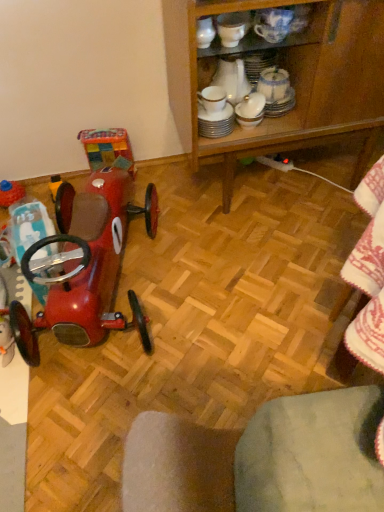
Question: Should I look upward or downward to see wooden cabinet at center?

Choices:
 (A) down
 (B) up

Answer: (B)

Question: Does shiny red car at left, which is counted as the 1th toy, starting from the back, contain shiny red car at left, which is the 1th toy in right-to-left order?

Choices:
 (A) yes
 (B) no

Answer: (B)

Question: Is shiny red car at left, the second toy viewed from the front, positioned before shiny red car at left, acting as the second toy starting from the left?

Choices:
 (A) yes
 (B) no

Answer: (B)

Question: From a real-world perspective, is shiny red car at left, which ranks as the second toy in right-to-left order, located beneath shiny red car at left, arranged as the 2th toy when viewed from the back?

Choices:
 (A) no
 (B) yes

Answer: (B)

Question: Could you tell me if shiny red car at left, the 1th toy from the left, is facing shiny red car at left, which is the first toy from front to back?

Choices:
 (A) no
 (B) yes

Answer: (A)

Question: From the image's perspective, would you say shiny red car at left, the second toy viewed from the front, is shown under shiny red car at left, arranged as the 2th toy when viewed from the back?

Choices:
 (A) yes
 (B) no

Answer: (B)

Question: Is shiny red car at left, the second toy viewed from the front, further to the viewer compared to shiny red car at left, acting as the second toy starting from the left?

Choices:
 (A) no
 (B) yes

Answer: (B)

Question: Is wooden cabinet at center at the right side of shiny red car at left, acting as the second toy starting from the left?

Choices:
 (A) yes
 (B) no

Answer: (A)

Question: Is wooden cabinet at center smaller than shiny red car at left, which is the 1th toy in right-to-left order?

Choices:
 (A) no
 (B) yes

Answer: (A)

Question: Does wooden cabinet at center have a greater height compared to shiny red car at left, acting as the second toy starting from the left?

Choices:
 (A) no
 (B) yes

Answer: (B)

Question: Does wooden cabinet at center have a greater width compared to shiny red car at left, arranged as the 2th toy when viewed from the back?

Choices:
 (A) no
 (B) yes

Answer: (A)

Question: From a real-world perspective, is wooden cabinet at center located higher than shiny red car at left, which is the 1th toy in right-to-left order?

Choices:
 (A) no
 (B) yes

Answer: (B)

Question: From the image's perspective, is wooden cabinet at center above shiny red car at left, which is the first toy from front to back?

Choices:
 (A) no
 (B) yes

Answer: (B)

Question: From a real-world perspective, is shiny red car at left, which is counted as the 1th toy, starting from the back, located higher than wooden cabinet at center?

Choices:
 (A) yes
 (B) no

Answer: (B)